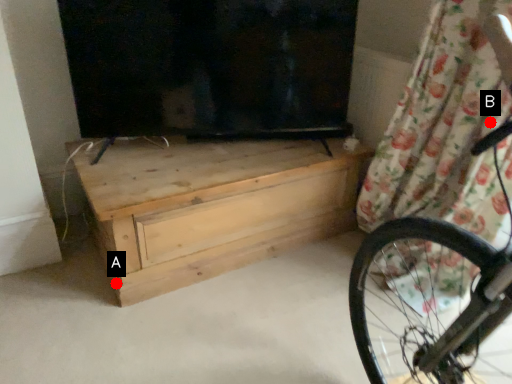
Question: Two points are circled on the image, labeled by A and B beside each circle. Which of the following is the closest to the observer?

Choices:
 (A) A is closer
 (B) B is closer

Answer: (B)